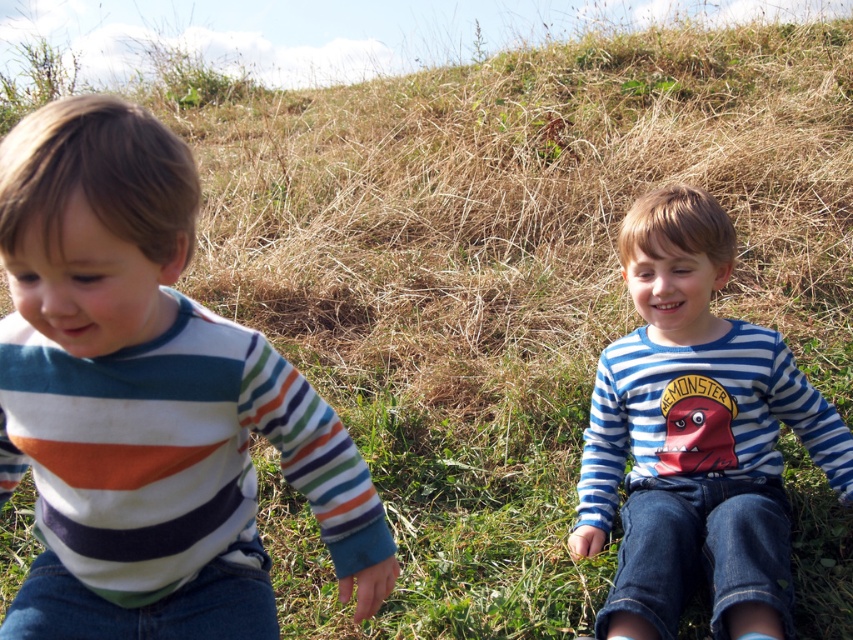
You are a fashion designer observing two children wearing striped shirts. The striped cotton shirt at left and the blue striped shirt at center. Which shirt has a narrower width?

The striped cotton shirt at left has a lesser width compared to the blue striped shirt at center, so the striped cotton shirt at left is narrower.

Consider the image. You are a photographer trying to capture both children in a clear photo. Since the striped cotton shirt at left and the blue striped shirt at center are at different distances, which child should you focus on to ensure both are in focus?

You should focus on the blue striped shirt at center because it is farther away, ensuring the striped cotton shirt at left, which is closer, will also be in focus due to the depth of field extending from the closer to the farther subject.